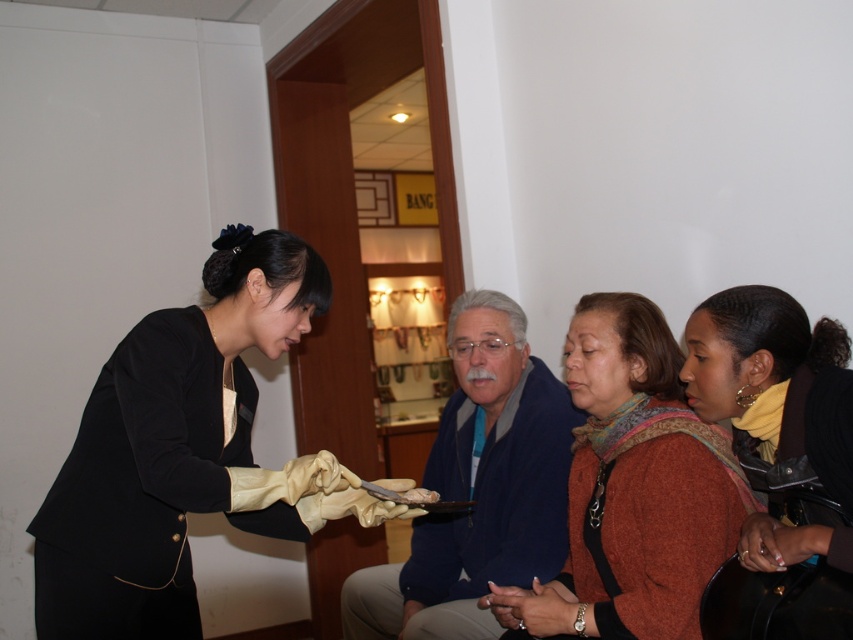
Where is `matte black suit at center`? matte black suit at center is located at coordinates (183, 451).

Based on the photo, between matte black suit at center and knitted wool sweater at center, which one is positioned higher?

Positioned higher is matte black suit at center.

Describe the element at coordinates (183, 451) in the screenshot. I see `matte black suit at center` at that location.

Image resolution: width=853 pixels, height=640 pixels. I want to click on matte black suit at center, so click(x=183, y=451).

What do you see at coordinates (631, 488) in the screenshot?
I see `knitted wool sweater at center` at bounding box center [631, 488].

Measure the distance between knitted wool sweater at center and brown leather jacket at right.

knitted wool sweater at center and brown leather jacket at right are 12.52 inches apart.

Between point (614, 356) and point (741, 561), which one is positioned in front?

Point (741, 561)

This screenshot has height=640, width=853. Identify the location of knitted wool sweater at center. (631, 488).

Is blue fabric jacket at center closer to the viewer compared to brown leather jacket at right?

No, blue fabric jacket at center is further to the viewer.

I want to click on blue fabric jacket at center, so click(x=479, y=486).

I want to click on blue fabric jacket at center, so click(x=479, y=486).